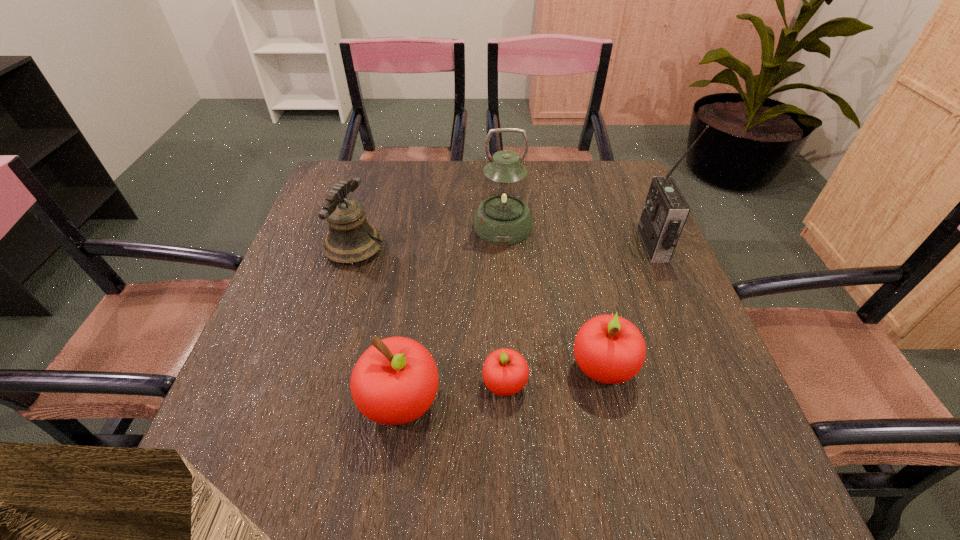
You are a GUI agent. You are given a task and a screenshot of the screen. Output one action in this format:
    pyautogui.click(x=<x>, y=<y>)
    Task: Click on the blank area located 0.380m on the back of the fifth tallest object
    The image size is (960, 540).
    Given the screenshot: What is the action you would take?
    pyautogui.click(x=569, y=225)

Identify the location of free space located 0.210m on the left of the fifth shortest object. This screenshot has width=960, height=540. (395, 226).

The image size is (960, 540). Identify the location of vacant space situated on the display of the radio receiver. (608, 245).

Where is `blank space located 0.080m on the display of the radio receiver`? blank space located 0.080m on the display of the radio receiver is located at coordinates (612, 245).

The height and width of the screenshot is (540, 960). I want to click on vacant space located on the display of the radio receiver, so click(x=492, y=245).

Find the location of a particular element. blank space located on the front of the leftmost object is located at coordinates (314, 379).

Where is `object that is positioned at the left edge`? This screenshot has height=540, width=960. object that is positioned at the left edge is located at coordinates (349, 240).

Where is `apple located in the right edge section of the desktop`? The width and height of the screenshot is (960, 540). apple located in the right edge section of the desktop is located at coordinates (609, 349).

Locate an element on the screen. radio receiver at the right edge is located at coordinates (665, 211).

This screenshot has width=960, height=540. I want to click on object that is at the near right corner, so click(x=609, y=349).